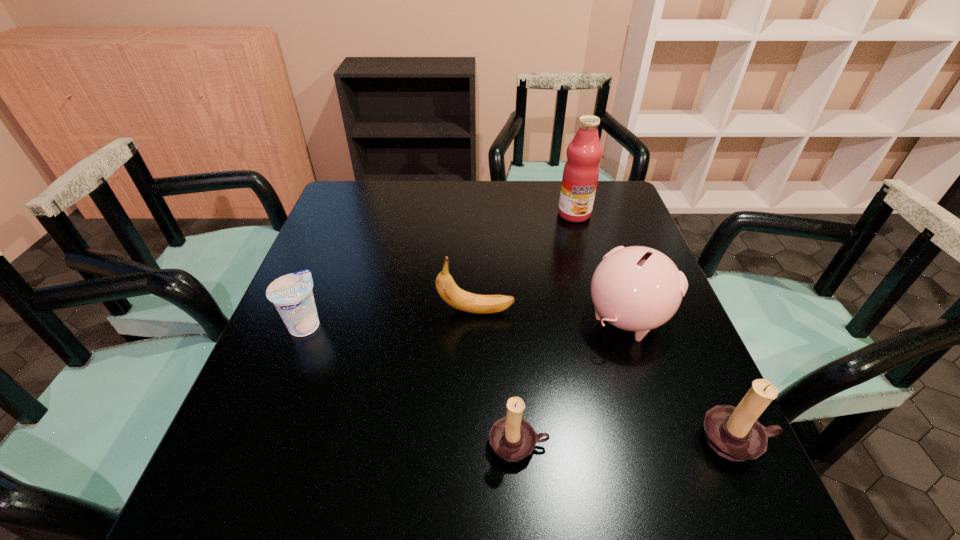
The candle holders are evenly distributed in the image. To maintain this, where would you place another candle holder on the left? Please point to a free space. Please provide its 2D coordinates. Your answer should be formatted as a tuple, i.e. [(x, y)], where the tuple contains the x and y coordinates of a point satisfying the conditions above.

[(297, 449)]